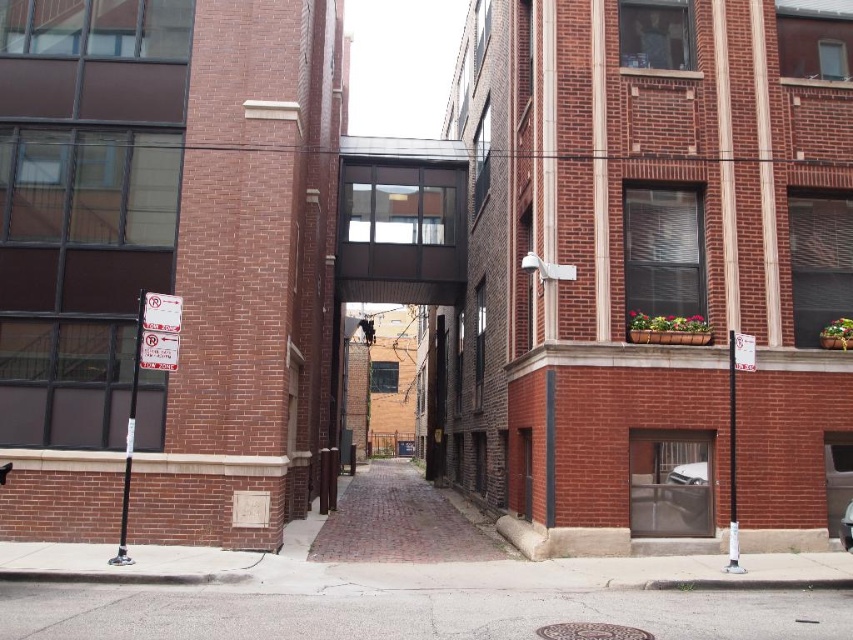
Question: Which of the following is the farthest from the observer?

Choices:
 (A) (369, 492)
 (B) (140, 300)
 (C) (848, 515)
 (D) (675, 483)

Answer: (A)

Question: Is brick pavement at center below metallic silver car at center?

Choices:
 (A) no
 (B) yes

Answer: (B)

Question: Which of the following is the farthest from the observer?

Choices:
 (A) (318, 625)
 (B) (679, 477)
 (C) (373, 467)
 (D) (846, 509)

Answer: (C)

Question: Is brick pavement at center wider than white glossy car at center?

Choices:
 (A) no
 (B) yes

Answer: (B)

Question: Is gray asphalt at lower center wider than white plastic sign at left?

Choices:
 (A) yes
 (B) no

Answer: (A)

Question: Which of the following is the closest to the observer?

Choices:
 (A) white plastic sign at left
 (B) brick pavement at center
 (C) white glossy car at center

Answer: (A)